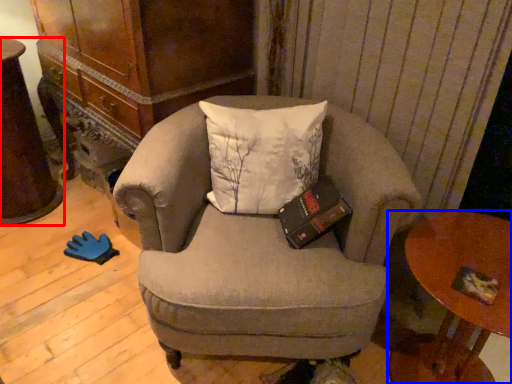
Question: Which of the following is the closest to the observer, desk (highlighted by a red box) or table (highlighted by a blue box)?

Choices:
 (A) desk
 (B) table

Answer: (B)